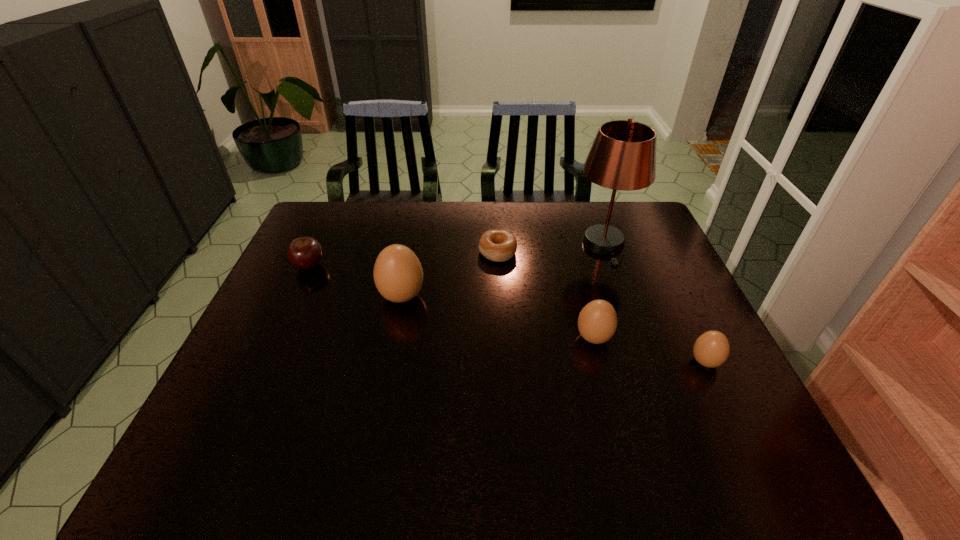
Where is `free space for an extra boiled_egg to achieve even spacing`? The image size is (960, 540). free space for an extra boiled_egg to achieve even spacing is located at coordinates (493, 316).